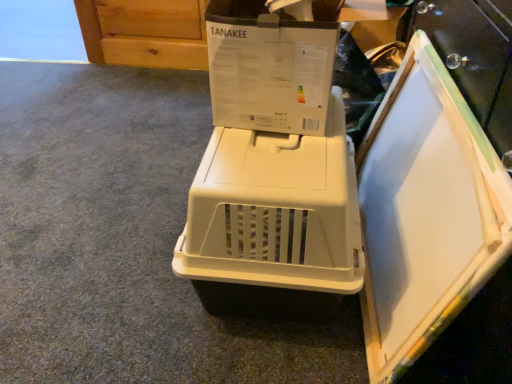
Image resolution: width=512 pixels, height=384 pixels. Describe the element at coordinates (276, 210) in the screenshot. I see `beige plastic pet carrier at center` at that location.

Where is `beige plastic pet carrier at center`? beige plastic pet carrier at center is located at coordinates (276, 210).

The height and width of the screenshot is (384, 512). What do you see at coordinates (426, 212) in the screenshot?
I see `white plastic board at right` at bounding box center [426, 212].

The height and width of the screenshot is (384, 512). I want to click on white plastic board at right, so [x=426, y=212].

In order to face white plastic board at right, should I rotate leftwards or rightwards?

A 19.094 degree turn to the right will do.

Where is `beige plastic pet carrier at center`? The image size is (512, 384). beige plastic pet carrier at center is located at coordinates (276, 210).

Can you confirm if beige plastic pet carrier at center is positioned to the left of white plastic board at right?

Indeed, beige plastic pet carrier at center is positioned on the left side of white plastic board at right.

Is the position of beige plastic pet carrier at center less distant than that of white plastic board at right?

No, it is not.

Is point (341, 128) farther from camera compared to point (482, 134)?

Yes, it is behind point (482, 134).

From the image's perspective, is beige plastic pet carrier at center positioned above or below white plastic board at right?

Clearly, from the image's perspective, beige plastic pet carrier at center is below white plastic board at right.

From a real-world perspective, is beige plastic pet carrier at center above or below white plastic board at right?

beige plastic pet carrier at center is below white plastic board at right.

Considering the relative sizes of beige plastic pet carrier at center and white plastic board at right in the image provided, is beige plastic pet carrier at center thinner than white plastic board at right?

Incorrect, the width of beige plastic pet carrier at center is not less than that of white plastic board at right.

Is beige plastic pet carrier at center taller than white plastic board at right?

No.

Is beige plastic pet carrier at center smaller than white plastic board at right?

No, beige plastic pet carrier at center is not smaller than white plastic board at right.

Which is correct: beige plastic pet carrier at center is inside white plastic board at right, or outside of it?

beige plastic pet carrier at center is not inside white plastic board at right, it's outside.

Are beige plastic pet carrier at center and white plastic board at right far apart?

A: That's not correct — beige plastic pet carrier at center is a little close to white plastic board at right.

Is beige plastic pet carrier at center facing away from white plastic board at right?

Yes, beige plastic pet carrier at center's orientation is away from white plastic board at right.

The width and height of the screenshot is (512, 384). Find the location of `appliance above the beige plastic pet carrier at center (from a real-world perspective)`. appliance above the beige plastic pet carrier at center (from a real-world perspective) is located at coordinates (426, 212).

Is white plastic board at right to the left of beige plastic pet carrier at center from the viewer's perspective?

No.

Is white plastic board at right closer to the viewer compared to beige plastic pet carrier at center?

That is True.

Does point (392, 379) come behind point (232, 251)?

No.

From the image's perspective, is white plastic board at right located beneath beige plastic pet carrier at center?

No, from the image's perspective, white plastic board at right is not below beige plastic pet carrier at center.

From a real-world perspective, which is physically above, white plastic board at right or beige plastic pet carrier at center?

In real-world perspective, white plastic board at right is above.

Looking at their sizes, would you say white plastic board at right is wider or thinner than beige plastic pet carrier at center?

Clearly, white plastic board at right has less width compared to beige plastic pet carrier at center.

Considering the sizes of objects white plastic board at right and beige plastic pet carrier at center in the image provided, who is shorter, white plastic board at right or beige plastic pet carrier at center?

Standing shorter between the two is beige plastic pet carrier at center.

From the picture: Who is bigger, white plastic board at right or beige plastic pet carrier at center?

With larger size is beige plastic pet carrier at center.

Is white plastic board at right completely or partially outside of beige plastic pet carrier at center?

Absolutely, white plastic board at right is external to beige plastic pet carrier at center.

Is white plastic board at right positioned far away from beige plastic pet carrier at center?

white plastic board at right is actually quite close to beige plastic pet carrier at center.

Is white plastic board at right oriented away from beige plastic pet carrier at center?

Yes, white plastic board at right is facing away from beige plastic pet carrier at center.

Where is `appliance above the beige plastic pet carrier at center (from a real-world perspective)`? The image size is (512, 384). appliance above the beige plastic pet carrier at center (from a real-world perspective) is located at coordinates (426, 212).

There is a beige plastic pet carrier at center. Find the location of `appliance above it (from a real-world perspective)`. appliance above it (from a real-world perspective) is located at coordinates (426, 212).

In order to click on appliance located above the beige plastic pet carrier at center (from the image's perspective) in this screenshot , I will do `click(426, 212)`.